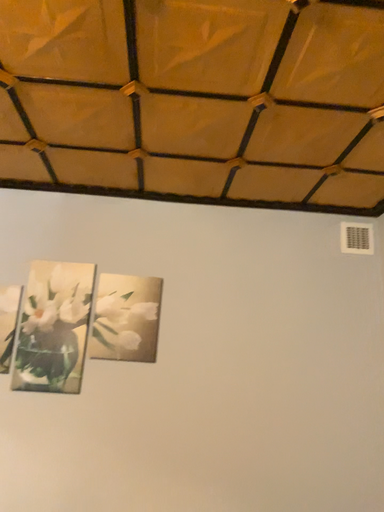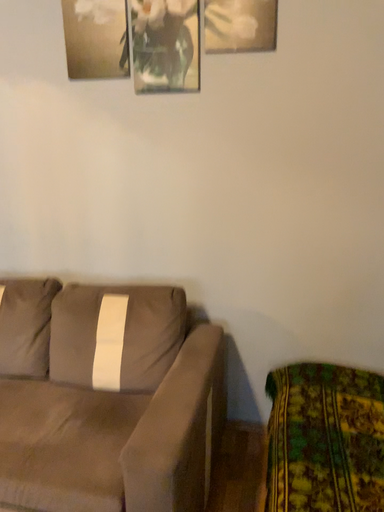
Question: Which way did the camera rotate in the video?

Choices:
 (A) rotated right
 (B) rotated left

Answer: (B)